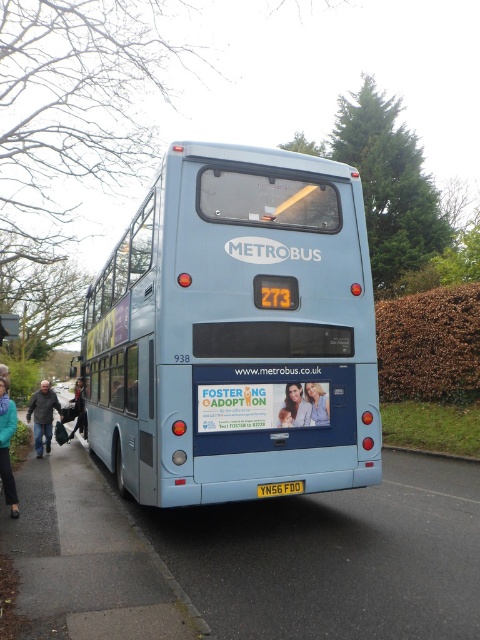
From the picture: Is dark gray jacket at left below yellow matte license plate at center?

Yes.

Between dark gray jacket at left and yellow matte license plate at center, which one is positioned lower?

dark gray jacket at left is lower down.

Between point (43, 381) and point (261, 493), which one is positioned behind?

The point (43, 381) is more distant.

The height and width of the screenshot is (640, 480). I want to click on dark gray jacket at left, so click(x=43, y=416).

Does point (37, 449) come in front of point (304, 392)?

No, it is behind (304, 392).

Can you confirm if dark gray jacket at left is positioned above smooth blue shirt at center?

No.

Between point (45, 419) and point (313, 397), which one is positioned in front?

Positioned in front is point (313, 397).

Find the location of a particular element. The width and height of the screenshot is (480, 640). dark gray jacket at left is located at coordinates (43, 416).

Measure the distance from gray asphalt pavement at lower left to dark gray jacket at left.

gray asphalt pavement at lower left and dark gray jacket at left are 10.48 meters apart from each other.

Which is more to the right, gray asphalt pavement at lower left or dark gray jacket at left?

gray asphalt pavement at lower left is more to the right.

At what (x,y) coordinates should I click in order to perform the action: click on gray asphalt pavement at lower left. Please return your answer as a coordinate pair (x, y). The height and width of the screenshot is (640, 480). Looking at the image, I should click on (249, 557).